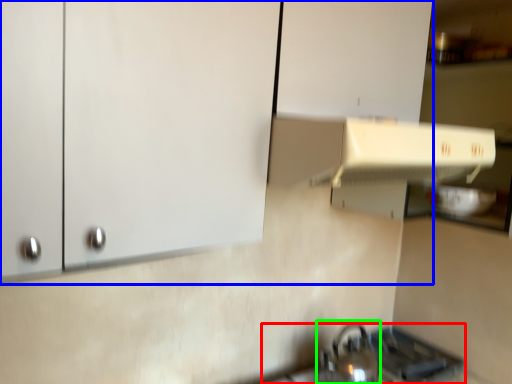
Question: Considering the real-world distances, which object is farthest from gas stove (highlighted by a red box)? cabinetry (highlighted by a blue box) or tea pot (highlighted by a green box)?

Choices:
 (A) cabinetry
 (B) tea pot

Answer: (A)